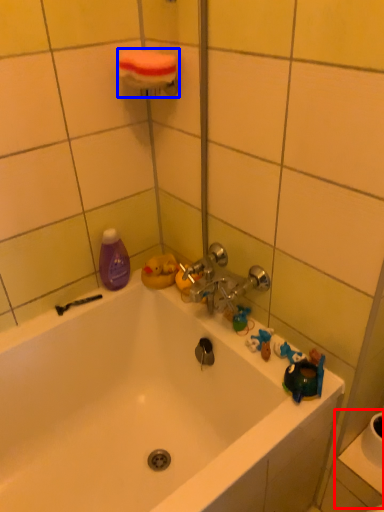
Question: Which object appears farthest to the camera in this image, sink (highlighted by a red box) or towel bar (highlighted by a blue box)?

Choices:
 (A) sink
 (B) towel bar

Answer: (A)